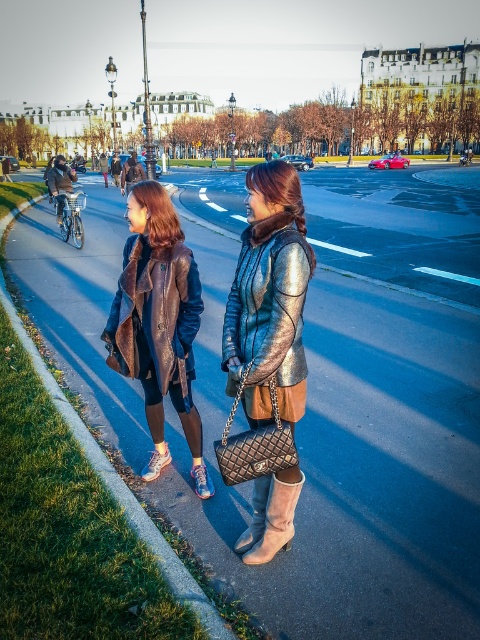
You are a pedestrian standing on the smooth asphalt sidewalk at lower left and want to reach the metallic silver jacket at center. Can you directly walk towards it without crossing any obstacles?

The smooth asphalt sidewalk at lower left is closer to the viewer than the metallic silver jacket at center, so you can directly walk towards it without crossing any obstacles.